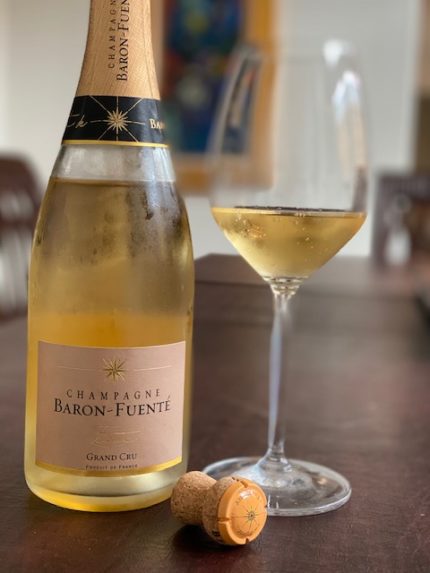
I want to click on wine in bottle, so click(x=95, y=321).